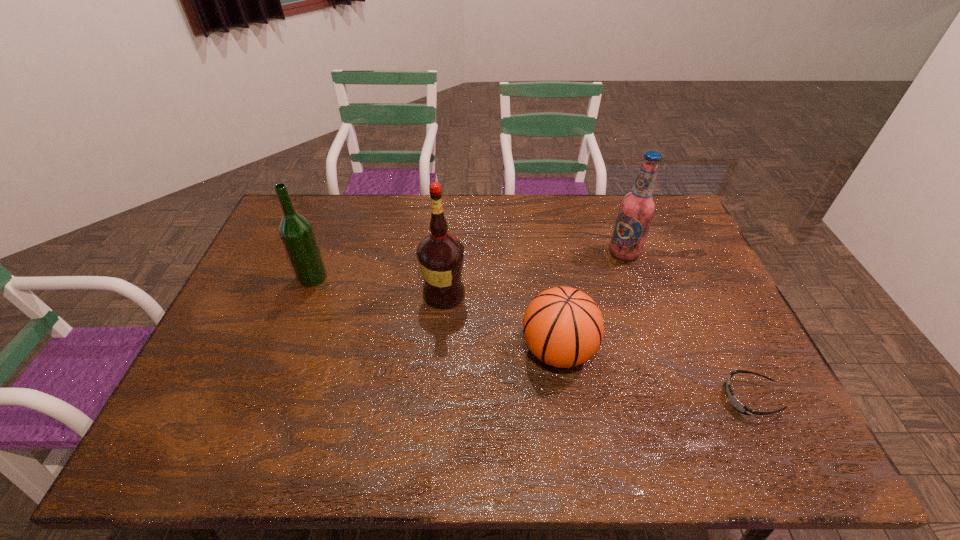
In the image, there is a desktop. At what (x,y) coordinates should I click in order to perform the action: click on vacant space at the far right corner. Please return your answer as a coordinate pair (x, y). The image size is (960, 540). Looking at the image, I should click on (662, 211).

This screenshot has width=960, height=540. I want to click on free space between the rightmost alcohol and the sunglasses, so click(687, 325).

Where is `vacant space in between the second alcohol from left to right and the farthest alcohol`? The width and height of the screenshot is (960, 540). vacant space in between the second alcohol from left to right and the farthest alcohol is located at coordinates (534, 273).

You are a GUI agent. You are given a task and a screenshot of the screen. Output one action in this format:
    pyautogui.click(x=<x>, y=<y>)
    Task: Click on the vacant area between the shortest object and the basketball
    
    Given the screenshot: What is the action you would take?
    pyautogui.click(x=654, y=374)

Locate an element on the screen. The image size is (960, 540). free area in between the leftmost alcohol and the rightmost alcohol is located at coordinates 468,265.

I want to click on vacant space that is in between the leftmost object and the basketball, so click(x=435, y=314).

The width and height of the screenshot is (960, 540). Identify the location of empty space between the sunglasses and the farthest object. (687, 325).

Where is `free point between the sunglasses and the basketball`? The image size is (960, 540). free point between the sunglasses and the basketball is located at coordinates (654, 374).

In order to click on object that stands as the fourth closest to the second alcohol from right to left in this screenshot , I will do `click(736, 404)`.

Identify which object is located as the nearest to the fourth object from right to left. Please provide its 2D coordinates. Your answer should be formatted as a tuple, i.e. [(x, y)], where the tuple contains the x and y coordinates of a point satisfying the conditions above.

[(563, 327)]